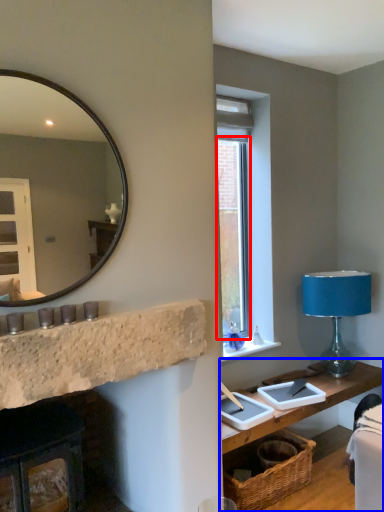
Question: Which object appears closest to the camera in this image, window (highlighted by a red box) or table (highlighted by a blue box)?

Choices:
 (A) window
 (B) table

Answer: (B)